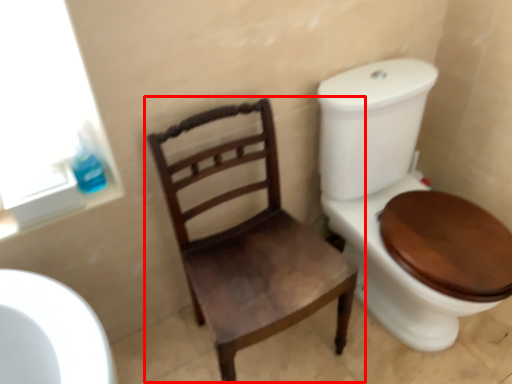
Question: From the image's perspective, what is the correct spatial positioning of chair (annotated by the red box) in reference to toilet paper?

Choices:
 (A) below
 (B) above

Answer: (A)